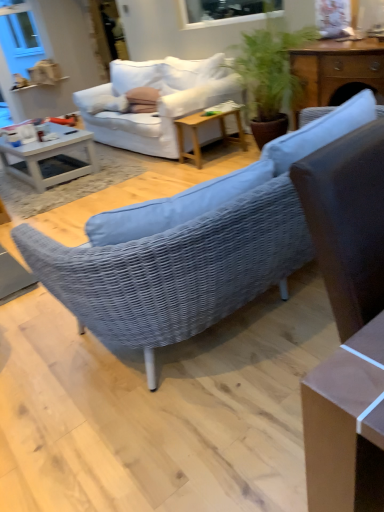
Question: Does woven fabric studio couch at center, the first studio couch in the left-to-right sequence, turn towards white glossy coffee table at left?

Choices:
 (A) no
 (B) yes

Answer: (A)

Question: Considering the relative positions of woven fabric studio couch at center, which is counted as the second studio couch, starting from the right, and white glossy coffee table at left in the image provided, is woven fabric studio couch at center, which is counted as the second studio couch, starting from the right, to the right of white glossy coffee table at left from the viewer's perspective?

Choices:
 (A) no
 (B) yes

Answer: (B)

Question: From a real-world perspective, is woven fabric studio couch at center, which is counted as the second studio couch, starting from the right, positioned over white glossy coffee table at left based on gravity?

Choices:
 (A) no
 (B) yes

Answer: (A)

Question: From a real-world perspective, is woven fabric studio couch at center, which is counted as the second studio couch, starting from the right, located beneath white glossy coffee table at left?

Choices:
 (A) yes
 (B) no

Answer: (A)

Question: Is white glossy coffee table at left located within woven fabric studio couch at center, the first studio couch in the left-to-right sequence?

Choices:
 (A) yes
 (B) no

Answer: (B)

Question: Is white plastic window screen at upper center bigger or smaller than woven fabric studio couch at center, the first studio couch in the left-to-right sequence?

Choices:
 (A) small
 (B) big

Answer: (A)

Question: From a real-world perspective, is white plastic window screen at upper center above or below woven fabric studio couch at center, which is counted as the second studio couch, starting from the right?

Choices:
 (A) above
 (B) below

Answer: (A)

Question: Is white plastic window screen at upper center in front of or behind woven fabric studio couch at center, the first studio couch in the left-to-right sequence, in the image?

Choices:
 (A) front
 (B) behind

Answer: (B)

Question: From the image's perspective, is white plastic window screen at upper center located above or below woven fabric studio couch at center, which is counted as the second studio couch, starting from the right?

Choices:
 (A) below
 (B) above

Answer: (B)

Question: Would you say wooden side table at center, which is counted as the 2th table, starting from the front, is inside or outside woven fabric studio couch at center, the first studio couch in the left-to-right sequence?

Choices:
 (A) outside
 (B) inside

Answer: (A)

Question: Is point (178, 139) closer or farther from the camera than point (259, 242)?

Choices:
 (A) farther
 (B) closer

Answer: (A)

Question: In terms of width, does wooden side table at center, which is the second table from right to left, look wider or thinner when compared to woven fabric studio couch at center, the first studio couch in the left-to-right sequence?

Choices:
 (A) thin
 (B) wide

Answer: (A)

Question: Considering the positions of wooden side table at center, marked as the first table in a back-to-front arrangement, and woven fabric studio couch at center, the first studio couch in the left-to-right sequence, in the image, is wooden side table at center, marked as the first table in a back-to-front arrangement, taller or shorter than woven fabric studio couch at center, the first studio couch in the left-to-right sequence,?

Choices:
 (A) tall
 (B) short

Answer: (A)

Question: From the image's perspective, relative to white glossy coffee table at left, is wooden cabinet at upper right, the second table from the back, above or below?

Choices:
 (A) above
 (B) below

Answer: (A)

Question: Is wooden cabinet at upper right, the first table positioned from the right, situated inside white glossy coffee table at left or outside?

Choices:
 (A) inside
 (B) outside

Answer: (B)